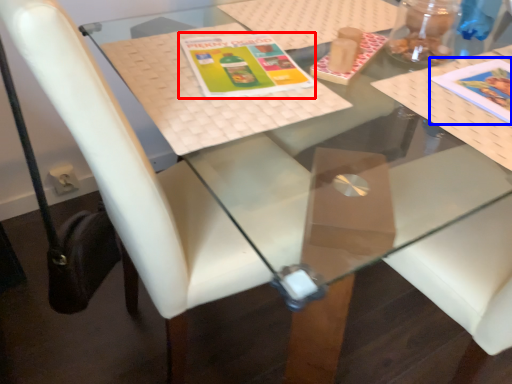
Question: Which of the following is the closest to the observer, book cover (highlighted by a red box) or book cover (highlighted by a blue box)?

Choices:
 (A) book cover
 (B) book cover

Answer: (B)